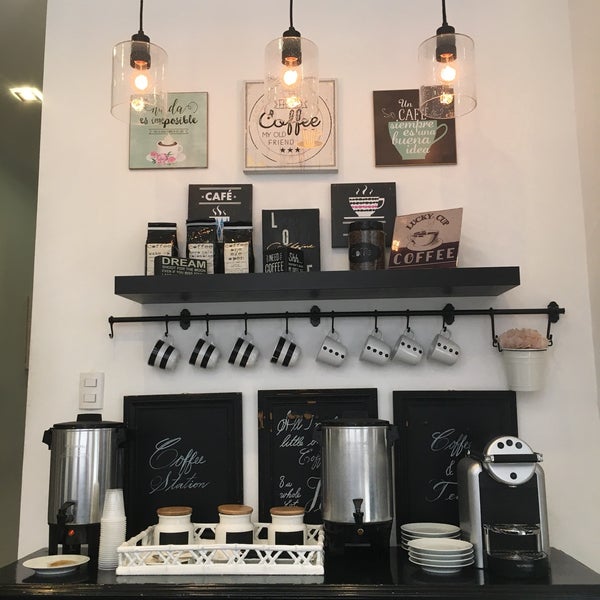
Image resolution: width=600 pixels, height=600 pixels. I want to click on black rectangular chalkboards, so click(102, 197), click(515, 190), click(144, 417), click(277, 412), click(409, 410).